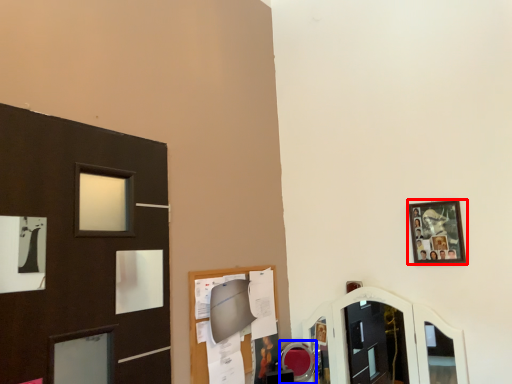
Question: Which of the following is the closest to the observer, picture frame (highlighted by a red box) or mirror (highlighted by a blue box)?

Choices:
 (A) picture frame
 (B) mirror

Answer: (A)